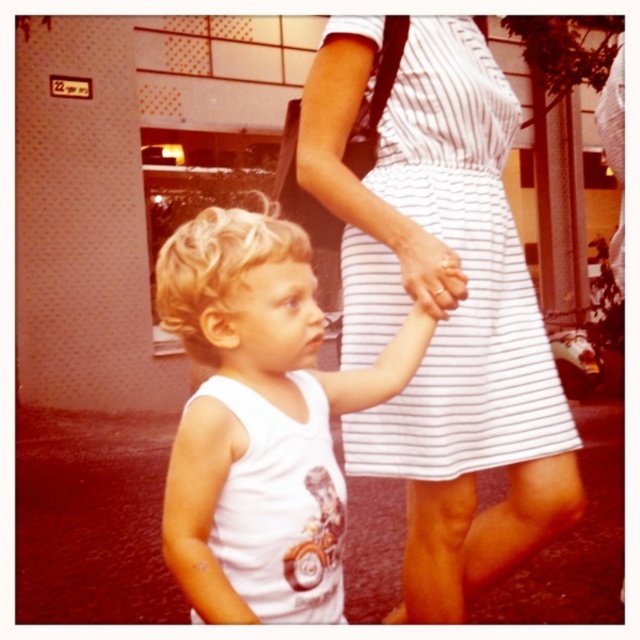
You are a photographer adjusting your camera to focus on two specific points in the image. The first point is at coordinates point (236,218) and the second is at point (445,250). Which point should you focus on first if you want to ensure the closest object is in sharp focus?

Point (236,218) is closer to the camera than point (445,250), so you should focus on point (236,218) first to ensure the closest object is in sharp focus.

You are a photographer standing at a certain distance from the white striped dress at center. You want to take a photo of it and ensure it fills the frame properly. If the recommended distance for optimal framing is 4 feet, is the current distance sufficient?

The distance of white striped dress at center from camera is 4.12 feet, which is slightly more than the recommended 4 feet. To ensure the dress fills the frame properly, you should move about 1.2 inches closer.

You are a photographer trying to capture the scene. You notice the white matte tank top at center and the white matte hand at center. Which object should you focus on if you want to capture the larger one in your shot?

The white matte tank top at center is bigger than the white matte hand at center, so you should focus on the white matte tank top at center to capture the larger one in your shot.